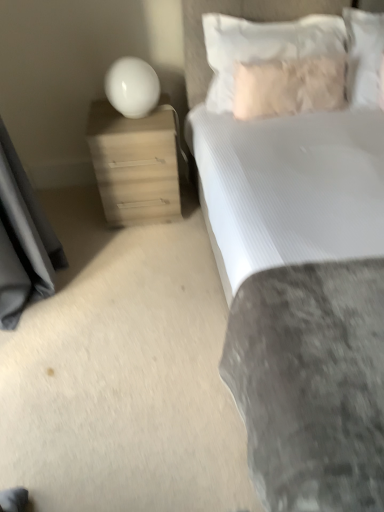
Measure the distance between fuzzy beige pillow at upper right, which ranks as the 2th pillow in left-to-right order, and camera.

fuzzy beige pillow at upper right, which ranks as the 2th pillow in left-to-right order, and camera are 1.83 meters apart from each other.

In the scene shown: Measure the distance between point (364, 14) and camera.

A distance of 1.97 meters exists between point (364, 14) and camera.

At what (x,y) coordinates should I click in order to perform the action: click on white soft pillow at upper right, the 1th pillow positioned from the left. Please return your answer as a coordinate pair (x, y). The width and height of the screenshot is (384, 512). Looking at the image, I should click on (262, 46).

Based on the photo, in order to face white glossy sphere at upper left, should I rotate leftwards or rightwards?

You should look left and rotate roughly 8.186 degrees.

Find the location of a particular element. fuzzy beige pillow at upper right, which is the second pillow from right to left is located at coordinates (289, 86).

Is white soft pillow at upper right, the 1th pillow in the right-to-left sequence, next to fuzzy beige pillow at upper right, which ranks as the 2th pillow in left-to-right order, and touching it?

No, white soft pillow at upper right, the 1th pillow in the right-to-left sequence, is not with fuzzy beige pillow at upper right, which ranks as the 2th pillow in left-to-right order.

Who is smaller, white soft pillow at upper right, the 1th pillow in the right-to-left sequence, or fuzzy beige pillow at upper right, which ranks as the 2th pillow in left-to-right order?

fuzzy beige pillow at upper right, which ranks as the 2th pillow in left-to-right order.

Does white soft pillow at upper right, the 1th pillow in the right-to-left sequence, appear on the right side of fuzzy beige pillow at upper right, which is the second pillow from right to left?

Correct, you'll find white soft pillow at upper right, the 1th pillow in the right-to-left sequence, to the right of fuzzy beige pillow at upper right, which is the second pillow from right to left.

From the image's perspective, is white soft pillow at upper right, the 1th pillow in the right-to-left sequence, located beneath fuzzy beige pillow at upper right, which ranks as the 2th pillow in left-to-right order?

Incorrect, from the image's perspective, white soft pillow at upper right, the 1th pillow in the right-to-left sequence, is higher than fuzzy beige pillow at upper right, which ranks as the 2th pillow in left-to-right order.

Considering the relative sizes of white glossy sphere at upper left and white textured bed at upper right in the image provided, is white glossy sphere at upper left shorter than white textured bed at upper right?

Indeed, white glossy sphere at upper left has a lesser height compared to white textured bed at upper right.

From a real-world perspective, is white glossy sphere at upper left on top of white textured bed at upper right?

Yes, from a real-world perspective, white glossy sphere at upper left is on top of white textured bed at upper right.

Is white glossy sphere at upper left aimed at white textured bed at upper right?

No, white glossy sphere at upper left is not oriented towards white textured bed at upper right.

Are white textured bed at upper right and matte wood nightstand at left far apart?

No, white textured bed at upper right is in close proximity to matte wood nightstand at left.

Does white textured bed at upper right turn towards matte wood nightstand at left?

No, white textured bed at upper right does not turn towards matte wood nightstand at left.

From a real-world perspective, is white textured bed at upper right located beneath matte wood nightstand at left?

No.

Which is in front, white textured bed at upper right or matte wood nightstand at left?

white textured bed at upper right is in front.

Find the location of `pillow that is the 2nd object to the right of the matte wood nightstand at left, starting at the anchor`. pillow that is the 2nd object to the right of the matte wood nightstand at left, starting at the anchor is located at coordinates (289, 86).

From the image's perspective, is matte wood nightstand at left located above fuzzy beige pillow at upper right, which ranks as the 2th pillow in left-to-right order?

No, from the image's perspective, matte wood nightstand at left is not over fuzzy beige pillow at upper right, which ranks as the 2th pillow in left-to-right order.

Between matte wood nightstand at left and fuzzy beige pillow at upper right, which is the second pillow from right to left, which one has more height?

matte wood nightstand at left is taller.

Looking at this image, between matte wood nightstand at left and fuzzy beige pillow at upper right, which ranks as the 2th pillow in left-to-right order, which one appears on the left side from the viewer's perspective?

matte wood nightstand at left.

From the picture: Considering the sizes of objects fuzzy beige pillow at upper right, which is the second pillow from right to left, and white soft pillow at upper right, which is the 3th pillow from right to left, in the image provided, who is smaller, fuzzy beige pillow at upper right, which is the second pillow from right to left, or white soft pillow at upper right, which is the 3th pillow from right to left,?

With smaller size is fuzzy beige pillow at upper right, which is the second pillow from right to left.

Is fuzzy beige pillow at upper right, which is the second pillow from right to left, wider than white soft pillow at upper right, which is the 3th pillow from right to left?

In fact, fuzzy beige pillow at upper right, which is the second pillow from right to left, might be narrower than white soft pillow at upper right, which is the 3th pillow from right to left.

Relative to white soft pillow at upper right, which is the 3th pillow from right to left, is fuzzy beige pillow at upper right, which ranks as the 2th pillow in left-to-right order, in front or behind?

Clearly, fuzzy beige pillow at upper right, which ranks as the 2th pillow in left-to-right order, is behind white soft pillow at upper right, which is the 3th pillow from right to left.

Where is `the 2nd pillow below the white soft pillow at upper right, which is the 3th pillow from right to left (from a real-world perspective)`? The image size is (384, 512). the 2nd pillow below the white soft pillow at upper right, which is the 3th pillow from right to left (from a real-world perspective) is located at coordinates (289, 86).

From a real-world perspective, is white soft pillow at upper right, the 1th pillow in the right-to-left sequence, physically above white soft pillow at upper right, which is the 3th pillow from right to left?

No.

Is white soft pillow at upper right, the 1th pillow in the right-to-left sequence, bigger than white soft pillow at upper right, which is the 3th pillow from right to left?

Incorrect, white soft pillow at upper right, the 1th pillow in the right-to-left sequence, is not larger than white soft pillow at upper right, which is the 3th pillow from right to left.

From the image's perspective, would you say white soft pillow at upper right, the 3th pillow positioned from the left, is shown under white soft pillow at upper right, which is the 3th pillow from right to left?

No, from the image's perspective, white soft pillow at upper right, the 3th pillow positioned from the left, is not below white soft pillow at upper right, which is the 3th pillow from right to left.

Between point (370, 23) and point (302, 24), which one is positioned in front?

The point (302, 24) is in front.

How many degrees apart are the facing directions of white soft pillow at upper right, the 3th pillow positioned from the left, and white textured bed at upper right?

They differ by 1.09 degrees in their facing directions.

Considering the relative sizes of white soft pillow at upper right, the 1th pillow in the right-to-left sequence, and white textured bed at upper right in the image provided, is white soft pillow at upper right, the 1th pillow in the right-to-left sequence, taller than white textured bed at upper right?

In fact, white soft pillow at upper right, the 1th pillow in the right-to-left sequence, may be shorter than white textured bed at upper right.

Considering the sizes of objects white soft pillow at upper right, the 1th pillow in the right-to-left sequence, and white textured bed at upper right in the image provided, who is smaller, white soft pillow at upper right, the 1th pillow in the right-to-left sequence, or white textured bed at upper right?

Smaller between the two is white soft pillow at upper right, the 1th pillow in the right-to-left sequence.

Is point (378, 24) farther from camera compared to point (294, 475)?

Yes, point (378, 24) is behind point (294, 475).

The height and width of the screenshot is (512, 384). Identify the location of the 1st pillow in front of the white soft pillow at upper right, the 1th pillow in the right-to-left sequence, counting from the anchor's position. pos(289,86).

You are a GUI agent. You are given a task and a screenshot of the screen. Output one action in this format:
    pyautogui.click(x=<x>, y=<y>)
    Task: Click on the lamp above the white textured bed at upper right (from the image's perspective)
    This screenshot has height=512, width=384.
    Given the screenshot: What is the action you would take?
    pyautogui.click(x=132, y=87)

Which object lies nearer to the anchor point white glossy sphere at upper left, matte wood nightstand at left or white textured bed at upper right?

Among the two, matte wood nightstand at left is located nearer to white glossy sphere at upper left.

Looking at the image, which one is located closer to white soft pillow at upper right, the 1th pillow in the right-to-left sequence, white glossy sphere at upper left or fuzzy beige pillow at upper right, which ranks as the 2th pillow in left-to-right order?

The object closer to white soft pillow at upper right, the 1th pillow in the right-to-left sequence, is fuzzy beige pillow at upper right, which ranks as the 2th pillow in left-to-right order.

Which object lies nearer to the anchor point white textured bed at upper right, white glossy sphere at upper left or matte wood nightstand at left?

Among the two, matte wood nightstand at left is located nearer to white textured bed at upper right.

From the image, which object appears to be nearer to matte wood nightstand at left, white soft pillow at upper right, the 1th pillow in the right-to-left sequence, or white glossy sphere at upper left?

Based on the image, white glossy sphere at upper left appears to be nearer to matte wood nightstand at left.

Which object lies further to the anchor point white textured bed at upper right, fuzzy beige pillow at upper right, which is the second pillow from right to left, or matte wood nightstand at left?

matte wood nightstand at left lies further to white textured bed at upper right than the other object.

When comparing their distances from matte wood nightstand at left, does fuzzy beige pillow at upper right, which is the second pillow from right to left, or white textured bed at upper right seem further?

white textured bed at upper right lies further to matte wood nightstand at left than the other object.

Based on their spatial positions, is matte wood nightstand at left or white soft pillow at upper right, the 3th pillow positioned from the left, closer to white soft pillow at upper right, which is the 3th pillow from right to left?

The object closer to white soft pillow at upper right, which is the 3th pillow from right to left, is white soft pillow at upper right, the 3th pillow positioned from the left.

Considering their positions, is white soft pillow at upper right, the 3th pillow positioned from the left, positioned further to white textured bed at upper right than fuzzy beige pillow at upper right, which is the second pillow from right to left?

white soft pillow at upper right, the 3th pillow positioned from the left, is positioned further to the anchor white textured bed at upper right.

You are a GUI agent. You are given a task and a screenshot of the screen. Output one action in this format:
    pyautogui.click(x=<x>, y=<y>)
    Task: Click on the pillow located between white soft pillow at upper right, which is the 3th pillow from right to left, and white soft pillow at upper right, the 3th pillow positioned from the left, in the left-right direction
    
    Given the screenshot: What is the action you would take?
    pyautogui.click(x=289, y=86)

At what (x,y) coordinates should I click in order to perform the action: click on lamp between matte wood nightstand at left and white soft pillow at upper right, which is the 3th pillow from right to left. Please return your answer as a coordinate pair (x, y). Looking at the image, I should click on (132, 87).

What are the coordinates of `pillow between matte wood nightstand at left and fuzzy beige pillow at upper right, which ranks as the 2th pillow in left-to-right order, from left to right` in the screenshot? It's located at (262, 46).

The width and height of the screenshot is (384, 512). What are the coordinates of `lamp between white textured bed at upper right and matte wood nightstand at left from front to back` in the screenshot? It's located at coord(132,87).